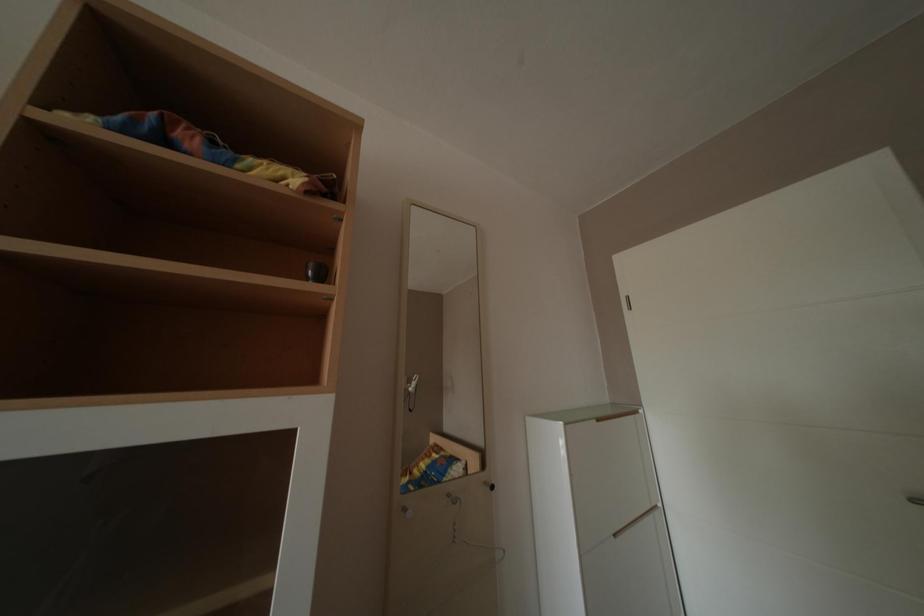
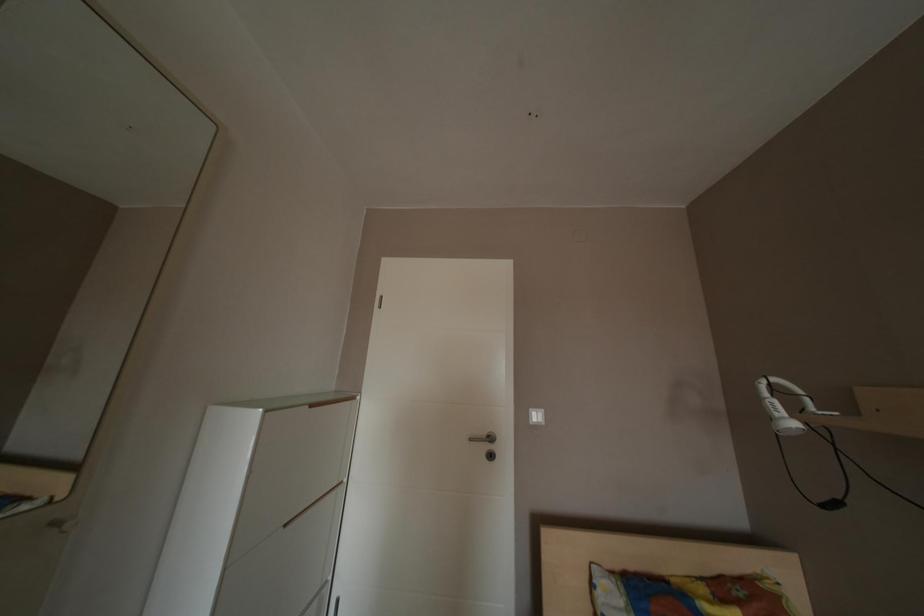
Question: Based on the continuous images, in which direction is the camera rotating? Reply with the corresponding letter.

Choices:
 (A) Left
 (B) Right
 (C) Up
 (D) Down

Answer: (B)